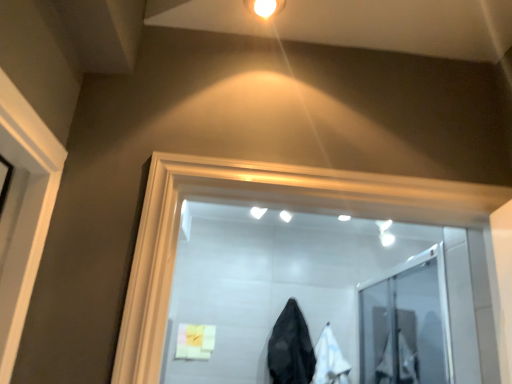
This screenshot has height=384, width=512. What are the coordinates of `soft yellow cloth at lower center` in the screenshot? It's located at (195, 341).

In order to click on black matte coat at center, the 2th garment viewed from the right in this screenshot , I will do `click(291, 348)`.

The width and height of the screenshot is (512, 384). I want to click on white fabric at center, which ranks as the first garment in right-to-left order, so click(x=330, y=360).

How much space does white fabric at center, which ranks as the first garment in right-to-left order, occupy horizontally?

white fabric at center, which ranks as the first garment in right-to-left order, is 4.62 inches in width.

Find the location of a particular element. Image resolution: width=512 pixels, height=384 pixels. soft yellow cloth at lower center is located at coordinates (195, 341).

Does point (294, 335) appear closer or farther from the camera than point (426, 258)?

Point (294, 335).

Consider the image. Is the surface of black matte coat at center, the first garment positioned from the left, in direct contact with transparent glass door at center?

No, black matte coat at center, the first garment positioned from the left, is not with transparent glass door at center.

How far apart are black matte coat at center, the first garment positioned from the left, and transparent glass door at center?

56.77 centimeters.

From a real-world perspective, is black matte coat at center, the 2th garment viewed from the right, beneath transparent glass door at center?

Yes, from a real-world perspective, black matte coat at center, the 2th garment viewed from the right, is under transparent glass door at center.

From a real-world perspective, which object stands above the other?

transparent glass door at center is physically above.

Can you tell me how much soft yellow cloth at lower center and transparent glass door at center differ in facing direction?

The angular difference between soft yellow cloth at lower center and transparent glass door at center is 4.16 degrees.

Find the location of a particular element. This screenshot has height=384, width=512. door lying above the soft yellow cloth at lower center (from the image's perspective) is located at coordinates (406, 323).

Which object is positioned more to the right, soft yellow cloth at lower center or transparent glass door at center?

Positioned to the right is transparent glass door at center.

Would you consider white fabric at center, which is the 2th garment in left-to-right order, to be distant from transparent glass door at center?

No, there isn't a large distance between white fabric at center, which is the 2th garment in left-to-right order, and transparent glass door at center.

Find the location of a particular element. This screenshot has height=384, width=512. garment that is the 1st object to the left of the transparent glass door at center, starting at the anchor is located at coordinates [330, 360].

Considering the relative sizes of white fabric at center, which ranks as the first garment in right-to-left order, and transparent glass door at center in the image provided, is white fabric at center, which ranks as the first garment in right-to-left order, shorter than transparent glass door at center?

Correct, white fabric at center, which ranks as the first garment in right-to-left order, is not as tall as transparent glass door at center.

Can you confirm if white fabric at center, which ranks as the first garment in right-to-left order, is positioned to the right of transparent glass door at center?

No.

You are a GUI agent. You are given a task and a screenshot of the screen. Output one action in this format:
    pyautogui.click(x=<x>, y=<y>)
    Task: Click on the garment above the white fabric at center, which ranks as the first garment in right-to-left order (from a real-world perspective)
    This screenshot has width=512, height=384.
    Given the screenshot: What is the action you would take?
    pos(291,348)

From the image's perspective, would you say black matte coat at center, the first garment positioned from the left, is positioned over white fabric at center, which is the 2th garment in left-to-right order?

Yes, from the image's perspective, black matte coat at center, the first garment positioned from the left, is over white fabric at center, which is the 2th garment in left-to-right order.

Between black matte coat at center, the first garment positioned from the left, and white fabric at center, which is the 2th garment in left-to-right order, which one has larger width?

black matte coat at center, the first garment positioned from the left.

Could you measure the distance between black matte coat at center, the first garment positioned from the left, and white fabric at center, which ranks as the first garment in right-to-left order?

6.04 inches.

How distant is transparent glass door at center from black matte coat at center, the first garment positioned from the left?

A distance of 22.35 inches exists between transparent glass door at center and black matte coat at center, the first garment positioned from the left.

Locate an element on the screen. The height and width of the screenshot is (384, 512). door below the black matte coat at center, the 2th garment viewed from the right (from the image's perspective) is located at coordinates (406, 323).

Does transparent glass door at center have a lesser height compared to black matte coat at center, the 2th garment viewed from the right?

No.

From a real-world perspective, which is physically above, transparent glass door at center or black matte coat at center, the 2th garment viewed from the right?

From a 3D spatial view, transparent glass door at center is above.

What's the angular difference between transparent glass door at center and soft yellow cloth at lower center's facing directions?

There is a 4.16-degree angle between the facing directions of transparent glass door at center and soft yellow cloth at lower center.

From the image's perspective, who appears lower, transparent glass door at center or soft yellow cloth at lower center?

soft yellow cloth at lower center appears lower in the image.

Where is `door above the soft yellow cloth at lower center (from a real-world perspective)`? door above the soft yellow cloth at lower center (from a real-world perspective) is located at coordinates (406, 323).

Which object is closer to the camera taking this photo, white fabric at center, which is the 2th garment in left-to-right order, or black matte coat at center, the first garment positioned from the left?

black matte coat at center, the first garment positioned from the left, is more forward.

Considering the sizes of objects white fabric at center, which ranks as the first garment in right-to-left order, and black matte coat at center, the 2th garment viewed from the right, in the image provided, who is thinner, white fabric at center, which ranks as the first garment in right-to-left order, or black matte coat at center, the 2th garment viewed from the right,?

white fabric at center, which ranks as the first garment in right-to-left order, is thinner.

From the image's perspective, which is below, white fabric at center, which is the 2th garment in left-to-right order, or black matte coat at center, the 2th garment viewed from the right?

white fabric at center, which is the 2th garment in left-to-right order, from the image's perspective.

The image size is (512, 384). What are the coordinates of `garment in front of the white fabric at center, which ranks as the first garment in right-to-left order` in the screenshot? It's located at (291, 348).

This screenshot has height=384, width=512. I want to click on door below the black matte coat at center, the 2th garment viewed from the right (from the image's perspective), so click(x=406, y=323).

Image resolution: width=512 pixels, height=384 pixels. I want to click on door above the soft yellow cloth at lower center (from the image's perspective), so click(406, 323).

Based on their spatial positions, is white fabric at center, which ranks as the first garment in right-to-left order, or black matte coat at center, the 2th garment viewed from the right, further from transparent glass door at center?

black matte coat at center, the 2th garment viewed from the right, is positioned further to the anchor transparent glass door at center.

Which object lies further to the anchor point soft yellow cloth at lower center, white fabric at center, which ranks as the first garment in right-to-left order, or black matte coat at center, the first garment positioned from the left?

white fabric at center, which ranks as the first garment in right-to-left order, is further to soft yellow cloth at lower center.

Which object lies further to the anchor point soft yellow cloth at lower center, transparent glass door at center or white fabric at center, which ranks as the first garment in right-to-left order?

Based on the image, transparent glass door at center appears to be further to soft yellow cloth at lower center.

Looking at the image, which one is located closer to soft yellow cloth at lower center, white fabric at center, which ranks as the first garment in right-to-left order, or transparent glass door at center?

white fabric at center, which ranks as the first garment in right-to-left order, lies closer to soft yellow cloth at lower center than the other object.

Based on their spatial positions, is black matte coat at center, the 2th garment viewed from the right, or soft yellow cloth at lower center closer to white fabric at center, which ranks as the first garment in right-to-left order?

Among the two, black matte coat at center, the 2th garment viewed from the right, is located nearer to white fabric at center, which ranks as the first garment in right-to-left order.

Which object lies nearer to the anchor point black matte coat at center, the first garment positioned from the left, white fabric at center, which is the 2th garment in left-to-right order, or soft yellow cloth at lower center?

white fabric at center, which is the 2th garment in left-to-right order, lies closer to black matte coat at center, the first garment positioned from the left, than the other object.

From the image, which object appears to be nearer to transparent glass door at center, black matte coat at center, the first garment positioned from the left, or soft yellow cloth at lower center?

black matte coat at center, the first garment positioned from the left, is closer to transparent glass door at center.

Looking at this image, from the image, which object appears to be farther from black matte coat at center, the first garment positioned from the left, soft yellow cloth at lower center or transparent glass door at center?

The object further to black matte coat at center, the first garment positioned from the left, is transparent glass door at center.

Identify the location of garment located between soft yellow cloth at lower center and white fabric at center, which is the 2th garment in left-to-right order, in the left-right direction. The image size is (512, 384). (291, 348).

Where is `garment between black matte coat at center, the 2th garment viewed from the right, and transparent glass door at center`? This screenshot has width=512, height=384. garment between black matte coat at center, the 2th garment viewed from the right, and transparent glass door at center is located at coordinates (330, 360).